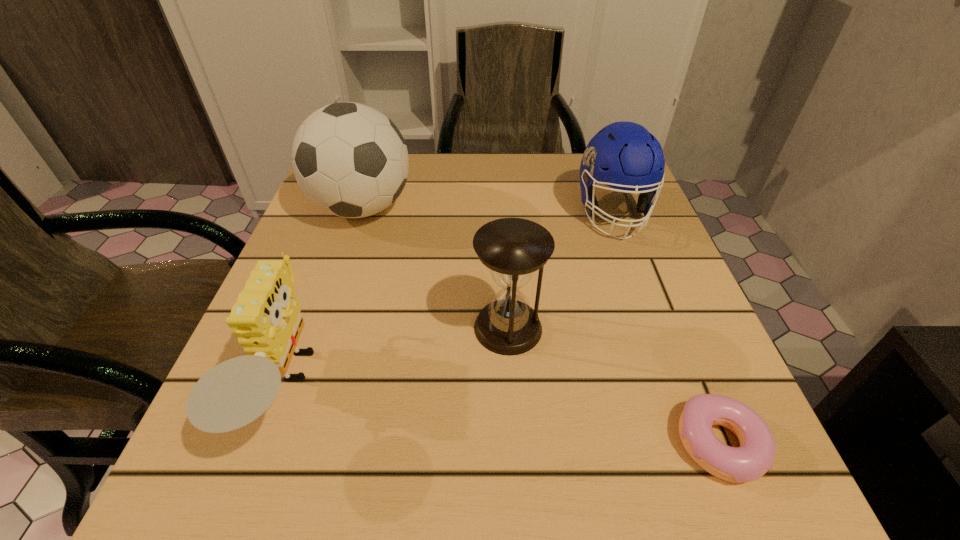
Locate an element on the screen. This screenshot has height=540, width=960. vacant area in the image that satisfies the following two spatial constraints: 1. on the front-facing side of the sponge; 2. on the left side of the shortest object is located at coordinates (266, 444).

Locate an element on the screen. Image resolution: width=960 pixels, height=540 pixels. vacant area in the image that satisfies the following two spatial constraints: 1. on the front side of the third object from right to left; 2. on the right side of the shortest object is located at coordinates (515, 444).